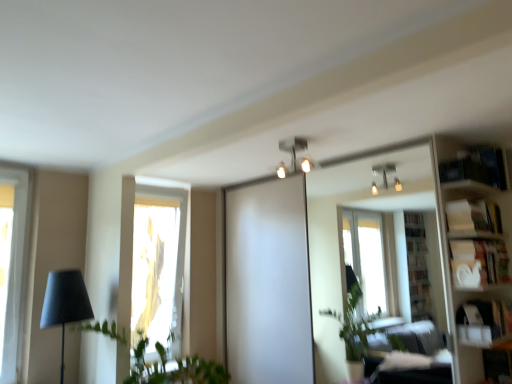
Question: Is clear glass mirror at upper center smaller than green leafy plant at left?

Choices:
 (A) no
 (B) yes

Answer: (B)

Question: Is clear glass mirror at upper center not inside green leafy plant at left?

Choices:
 (A) no
 (B) yes

Answer: (B)

Question: Is clear glass mirror at upper center shorter than green leafy plant at left?

Choices:
 (A) no
 (B) yes

Answer: (A)

Question: From the image's perspective, is clear glass mirror at upper center below green leafy plant at left?

Choices:
 (A) no
 (B) yes

Answer: (A)

Question: Can you confirm if clear glass mirror at upper center is thinner than green leafy plant at left?

Choices:
 (A) yes
 (B) no

Answer: (A)

Question: Is clear glass mirror at upper center with green leafy plant at left?

Choices:
 (A) yes
 (B) no

Answer: (B)

Question: From the image's perspective, is metallic silver light fixture at upper center above white glossy bookshelf at right?

Choices:
 (A) yes
 (B) no

Answer: (A)

Question: Is metallic silver light fixture at upper center oriented away from white glossy bookshelf at right?

Choices:
 (A) no
 (B) yes

Answer: (A)

Question: Is metallic silver light fixture at upper center at the right side of white glossy bookshelf at right?

Choices:
 (A) no
 (B) yes

Answer: (A)

Question: Could white glossy bookshelf at right be considered to be inside metallic silver light fixture at upper center?

Choices:
 (A) no
 (B) yes

Answer: (A)

Question: Is metallic silver light fixture at upper center positioned in front of white glossy bookshelf at right?

Choices:
 (A) yes
 (B) no

Answer: (B)

Question: Can you see metallic silver light fixture at upper center touching white glossy bookshelf at right?

Choices:
 (A) yes
 (B) no

Answer: (B)

Question: Does white glossy bookshelf at right have a smaller size compared to matte black lamp at left?

Choices:
 (A) yes
 (B) no

Answer: (B)